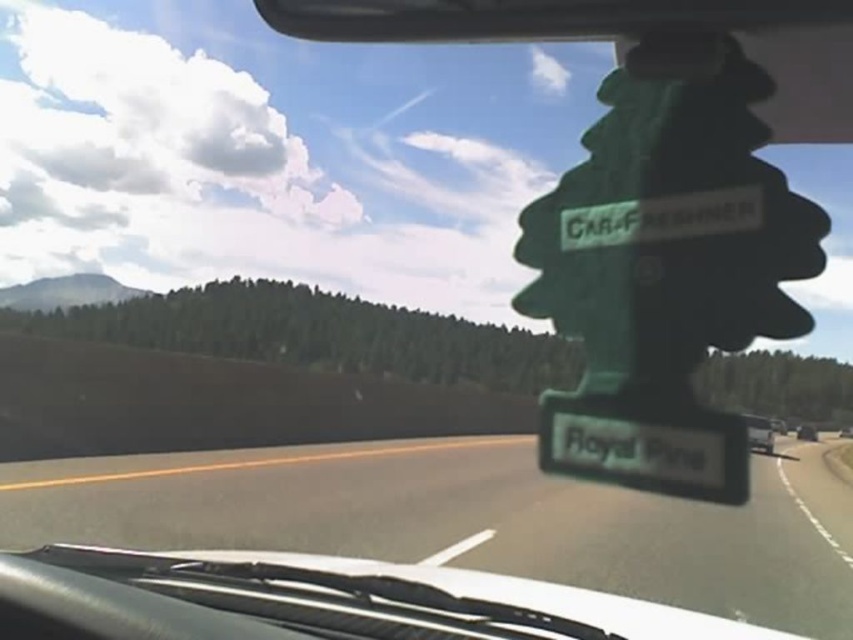
You are driving a car and see the black asphalt highway at center and the metallic silver van at center through your windshield. Which object is closer to you?

The black asphalt highway at center is closer to you because it is in front of the metallic silver van at center.

You are sitting in the driver seat of the car and want to know where the black asphalt highway at center is located. Based on the coordinates provided, can you determine its position relative to the car?

The black asphalt highway at center is located at coordinates point (450, 525), which means it is positioned to the right and slightly forward from the center of the car.